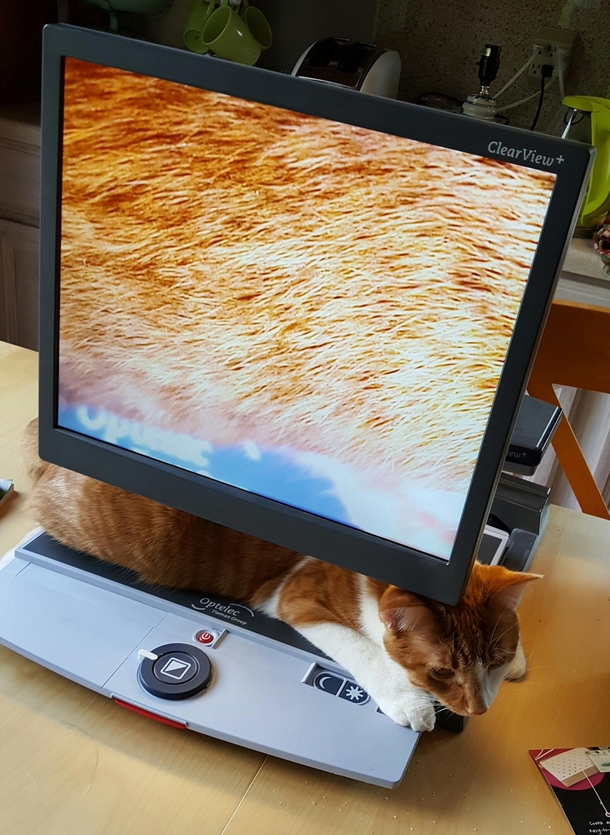
Locate an element on the screen. The height and width of the screenshot is (835, 610). monitor is located at coordinates (392, 549).